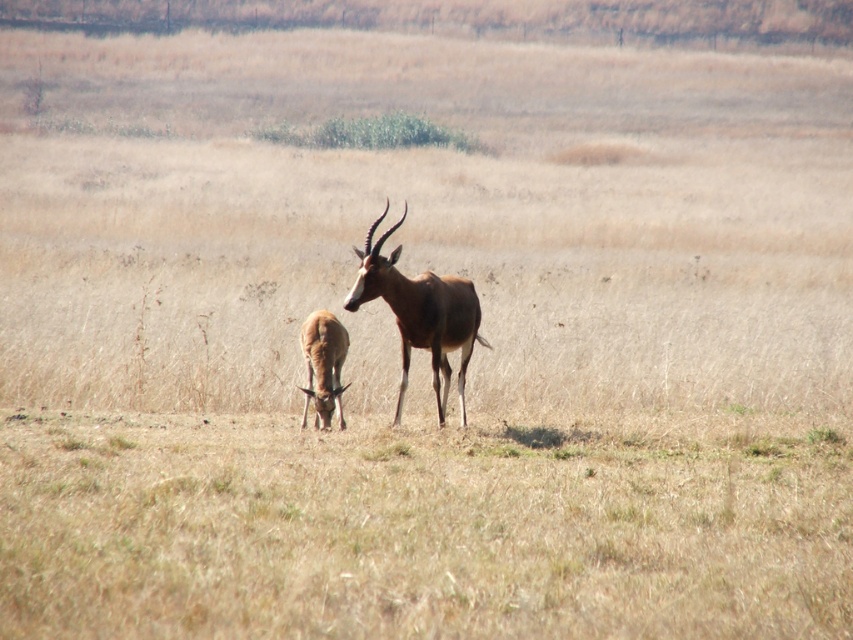
You are a wildlife photographer aiming to capture both the brown glossy antelope at center and the brown smooth antelope at lower left in a single frame. Based on their positions, which antelope would appear closer to the camera in your photo?

The brown smooth antelope at lower left appears closer to the camera because it is positioned below the brown glossy antelope at center, which is above it.

You are a wildlife photographer aiming to capture a clear photo of both the brown glossy antelope at center and the brown smooth antelope at lower left. Based on their positions, which antelope is closer to the camera?

The brown glossy antelope at center is closer to the camera because it is in front of the brown smooth antelope at lower left.

You are a wildlife photographer standing at the camera position. You want to capture a closeup shot of the brown glossy antelope at center. Considering your camera has a maximum zoom range of 10 meters, will you be able to get a clear closeup without moving closer?

The distance between the brown glossy antelope at center and the camera is 8.93 meters, which is within the camera maximum zoom range of 10 meters. Therefore, you can get a clear closeup without moving closer.